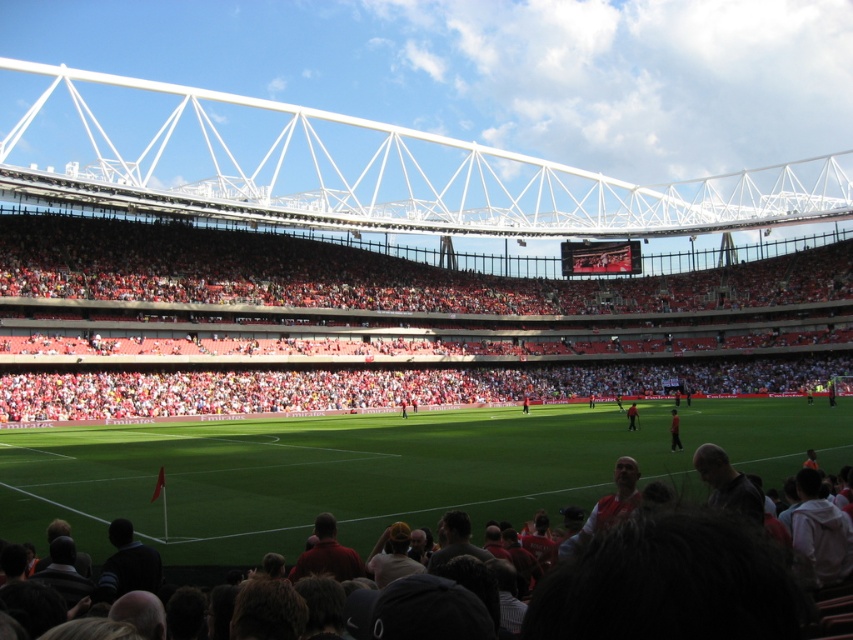
Question: Which is farther from the dark gray clothing at lower center?

Choices:
 (A) red plastic seats at center
 (B) dark red jersey at center
 (C) red shirt at center
 (D) green grass football field at center

Answer: (A)

Question: Is green grass football field at center above dark red jersey at center?

Choices:
 (A) no
 (B) yes

Answer: (B)

Question: Which object appears closest to the camera in this image?

Choices:
 (A) red shirt at center
 (B) green grass football field at center
 (C) dark red jersey at center

Answer: (B)

Question: Which point appears closest to the camera in this image?

Choices:
 (A) (519, 442)
 (B) (633, 413)
 (C) (210, 444)
 (D) (672, 422)

Answer: (D)

Question: Does green grass football field at center come in front of red plastic seats at center?

Choices:
 (A) no
 (B) yes

Answer: (B)

Question: Is red plastic seats at center smaller than dark red jersey at center?

Choices:
 (A) yes
 (B) no

Answer: (B)